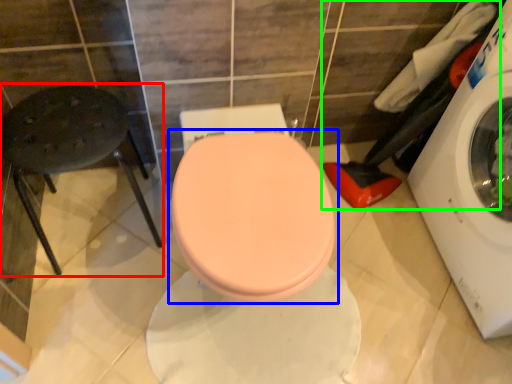
Question: Estimate the real-world distances between objects in this image. Which object is farther from bar stool (highlighted by a red box), toilet (highlighted by a blue box) or laundry (highlighted by a green box)?

Choices:
 (A) toilet
 (B) laundry

Answer: (B)